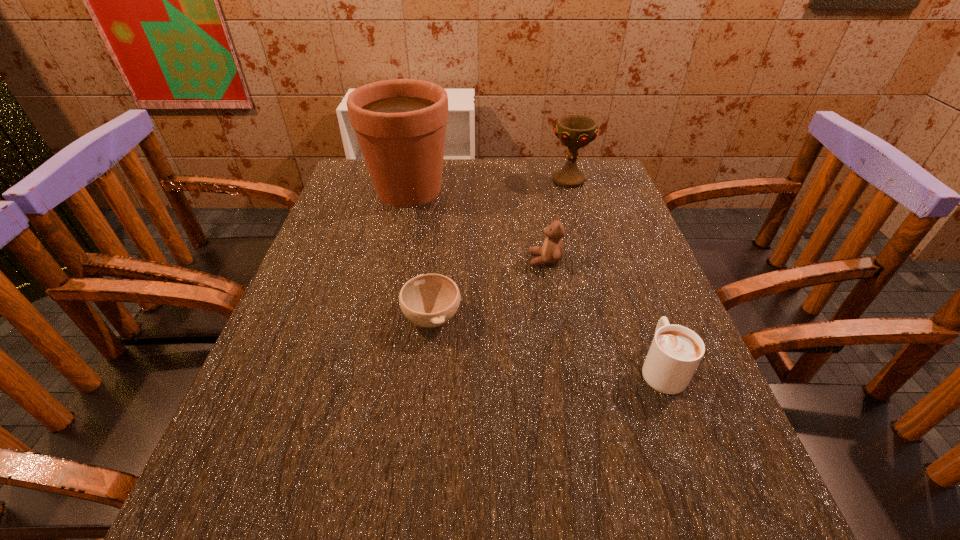
I want to click on vacant space located on the front-facing side of the teddy bear, so pyautogui.click(x=393, y=260).

You are a GUI agent. You are given a task and a screenshot of the screen. Output one action in this format:
    pyautogui.click(x=<x>, y=<y>)
    Task: Click on the free spot located 0.070m on the side with the handle of the fourth tallest object
    The height and width of the screenshot is (540, 960).
    Given the screenshot: What is the action you would take?
    pyautogui.click(x=642, y=315)

You are a GUI agent. You are given a task and a screenshot of the screen. Output one action in this format:
    pyautogui.click(x=<x>, y=<y>)
    Task: Click on the free space located on the side with the handle of the fourth tallest object
    
    Given the screenshot: What is the action you would take?
    pyautogui.click(x=642, y=315)

Locate an element on the screen. Image resolution: width=960 pixels, height=540 pixels. free spot located 0.330m on the side with the handle of the fourth tallest object is located at coordinates (613, 239).

At what (x,y) coordinates should I click in order to perform the action: click on vacant area situated on the left of the bowl. Please return your answer as a coordinate pair (x, y). The image size is (960, 540). Looking at the image, I should click on (279, 318).

At what (x,y) coordinates should I click in order to perform the action: click on flowerpot present at the far edge. Please return your answer as a coordinate pair (x, y). The height and width of the screenshot is (540, 960). Looking at the image, I should click on pos(400,124).

The image size is (960, 540). Find the location of `chalice positioned at the far edge`. chalice positioned at the far edge is located at coordinates (574, 131).

Image resolution: width=960 pixels, height=540 pixels. Find the location of `object located at the left edge`. object located at the left edge is located at coordinates (400, 124).

Locate an element on the screen. The width and height of the screenshot is (960, 540). chalice that is at the right edge is located at coordinates pos(574,131).

Where is `cappuccino that is at the right edge`? The height and width of the screenshot is (540, 960). cappuccino that is at the right edge is located at coordinates (675, 352).